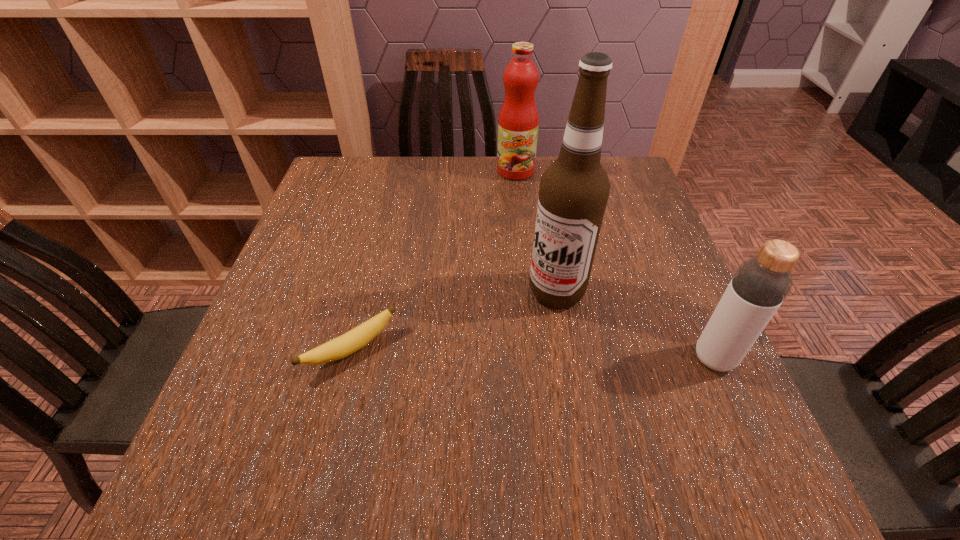
I want to click on free space between the leftmost object and the tallest object, so click(454, 321).

Locate an element on the screen. vacant space in between the banana and the rightmost object is located at coordinates (533, 354).

Choose which object is the third nearest neighbor to the banana. Please provide its 2D coordinates. Your answer should be formatted as a tuple, i.e. [(x, y)], where the tuple contains the x and y coordinates of a point satisfying the conditions above.

[(759, 286)]

You are a GUI agent. You are given a task and a screenshot of the screen. Output one action in this format:
    pyautogui.click(x=<x>, y=<y>)
    Task: Click on the object identified as the third closest to the third shortest object
    The width and height of the screenshot is (960, 540).
    Given the screenshot: What is the action you would take?
    pyautogui.click(x=759, y=286)

The image size is (960, 540). Find the location of `vacant space that satisfies the following two spatial constraints: 1. on the front side of the bottle; 2. on the right side of the tallest object`. vacant space that satisfies the following two spatial constraints: 1. on the front side of the bottle; 2. on the right side of the tallest object is located at coordinates (567, 359).

Identify the location of free location that satisfies the following two spatial constraints: 1. on the front side of the bottle; 2. on the left side of the fruit juice. This screenshot has height=540, width=960. (536, 359).

Find the location of a particular element. Image resolution: width=960 pixels, height=540 pixels. vacant region that satisfies the following two spatial constraints: 1. on the back side of the third shortest object; 2. on the right side of the shortest object is located at coordinates (396, 171).

The image size is (960, 540). What are the coordinates of `free space that satisfies the following two spatial constraints: 1. on the front side of the alcohol; 2. on the right side of the fruit juice` in the screenshot? It's located at (528, 292).